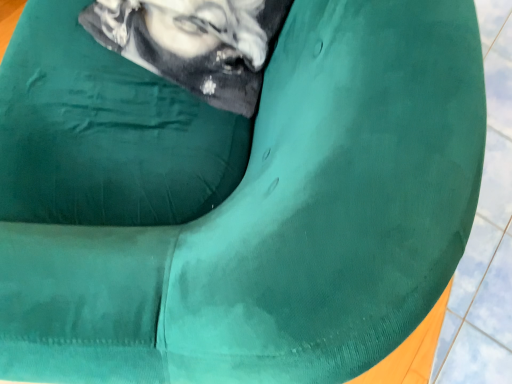
This screenshot has height=384, width=512. Describe the element at coordinates (105, 133) in the screenshot. I see `velvety green pillow at upper left` at that location.

The width and height of the screenshot is (512, 384). Find the location of `velvety green pillow at upper left`. velvety green pillow at upper left is located at coordinates (105, 133).

Locate an element on the screen. This screenshot has height=384, width=512. velvety green pillow at upper left is located at coordinates click(105, 133).